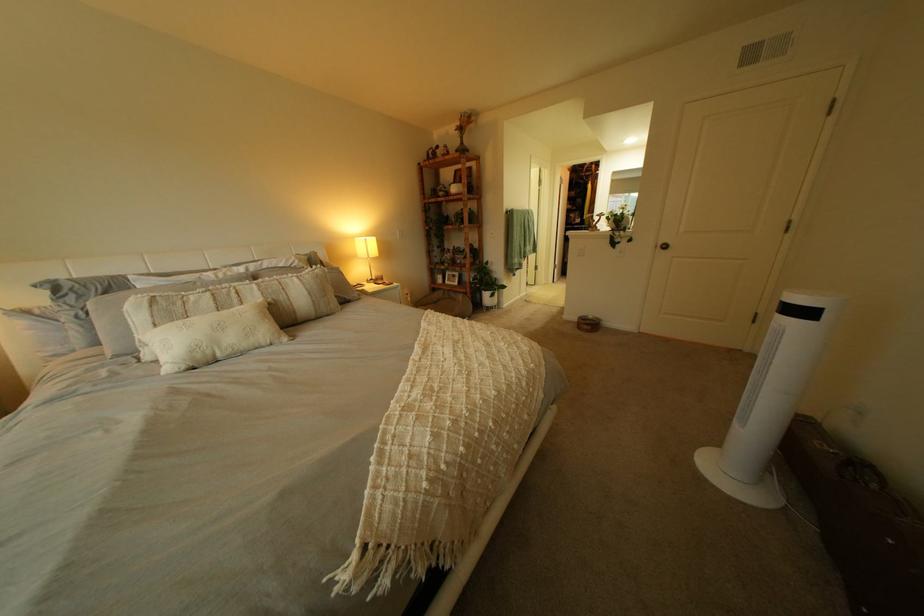
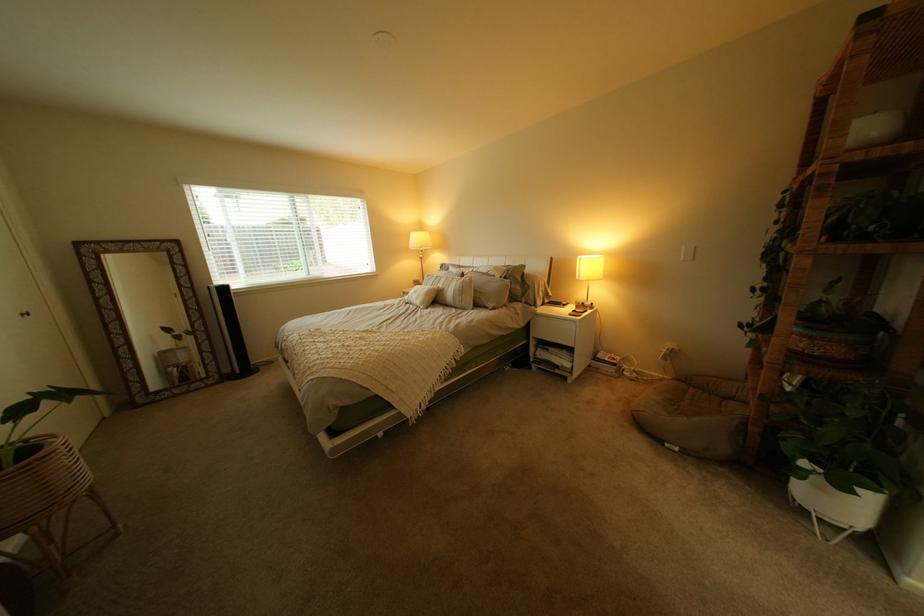
In the second image, find the point that corresponds to pixel 505 310 in the first image.

(821, 512)